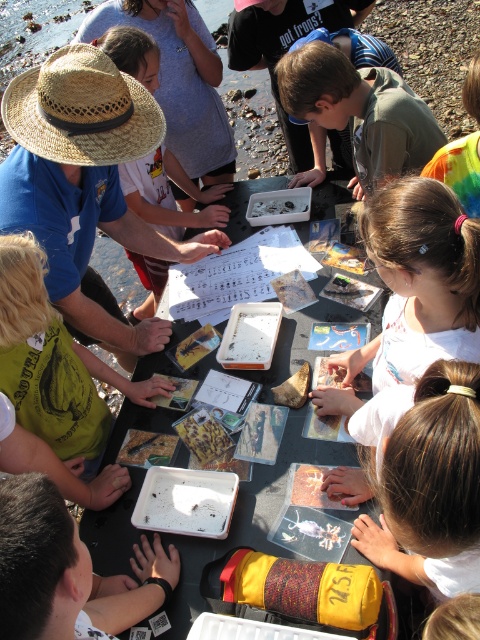
You are a teacher organizing an outdoor science class. You have a smooth plastic tray at center and a matte plastic food at center on the table. You need to place a small seashell that is 3 cm tall. Which object can the seashell fit under without exceeding its height?

The smooth plastic tray at center is taller than the matte plastic food at center. Since the seashell is 3 cm tall, it can fit under the smooth plastic tray at center but not under the matte plastic food at center if its height is less than 3 cm.

You are a teacher observing the children at the smooth plastic tray at center and the matte plastic food at center. Which object is closer to the children?

The smooth plastic tray at center is closer to the children because it is in front of the matte plastic food at center.